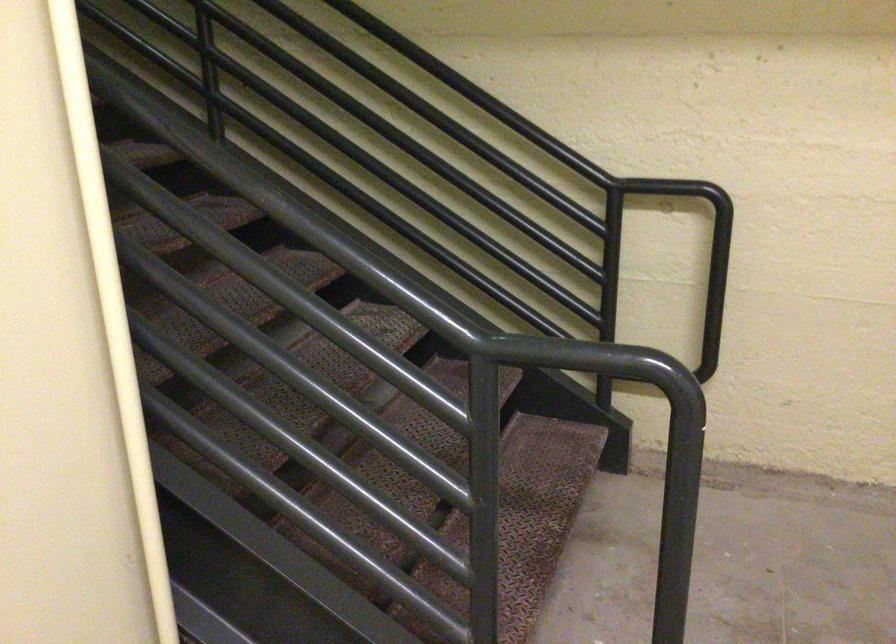
In order to click on stair handrail in this screenshot , I will do `click(546, 129)`.